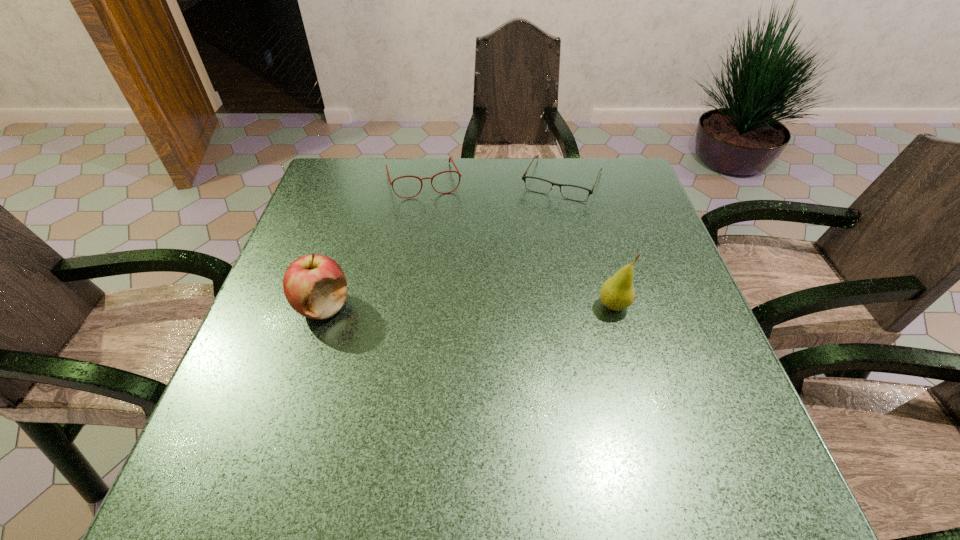
What are the coordinates of `free spot between the apple and the third tallest object` in the screenshot? It's located at (373, 244).

The image size is (960, 540). Identify the location of vacant area between the third tallest object and the pear. pos(518,244).

At what (x,y) coordinates should I click in order to perform the action: click on vacant space that is in between the left spectacles and the apple. Please return your answer as a coordinate pair (x, y). Looking at the image, I should click on (373, 244).

This screenshot has height=540, width=960. Identify the location of vacant area between the apple and the pear. (468, 306).

This screenshot has height=540, width=960. What are the coordinates of `the second closest object to the pear` in the screenshot? It's located at (450, 158).

The width and height of the screenshot is (960, 540). In order to click on object that is the second closest one to the apple in this screenshot , I will do `click(572, 192)`.

Where is `vacant area that satisfies the following two spatial constraints: 1. on the front side of the left spectacles; 2. on the left side of the pear`? The width and height of the screenshot is (960, 540). vacant area that satisfies the following two spatial constraints: 1. on the front side of the left spectacles; 2. on the left side of the pear is located at coordinates (403, 306).

The width and height of the screenshot is (960, 540). In order to click on vacant space that satisfies the following two spatial constraints: 1. on the bitten side of the pear; 2. on the right side of the apple in this screenshot , I will do `click(323, 306)`.

I want to click on vacant region that satisfies the following two spatial constraints: 1. on the front side of the pear; 2. on the right side of the taller spectacles, so click(x=403, y=306).

Identify the location of free spot that satisfies the following two spatial constraints: 1. on the front side of the pear; 2. on the right side of the left spectacles. (403, 306).